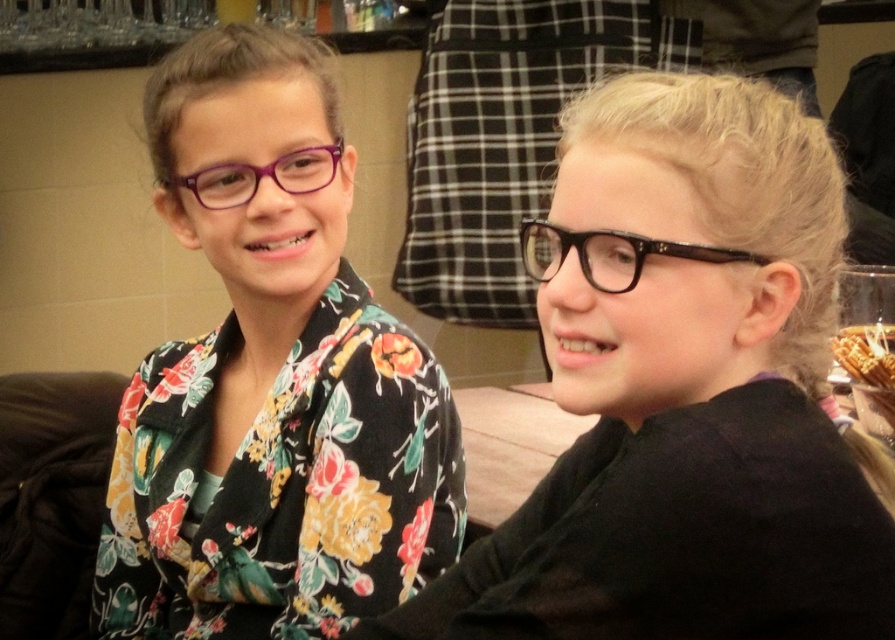
Question: Among these objects, which one is nearest to the camera?

Choices:
 (A) purple acetate glasses at left
 (B) black textured glasses at right
 (C) black glossy glasses at upper right

Answer: (C)

Question: Estimate the real-world distances between objects in this image. Which object is closer to the purple acetate glasses at left?

Choices:
 (A) matte purple glasses at left
 (B) black textured glasses at right

Answer: (A)

Question: Is matte purple glasses at left bigger than black textured glasses at right?

Choices:
 (A) no
 (B) yes

Answer: (B)

Question: Can you confirm if matte purple glasses at left is wider than black textured glasses at right?

Choices:
 (A) yes
 (B) no

Answer: (A)

Question: Which point is farther from the camera taking this photo?

Choices:
 (A) (631, 259)
 (B) (580, 220)
 (C) (322, 152)
 (D) (220, 561)

Answer: (C)

Question: Does matte purple glasses at left have a larger size compared to black textured glasses at right?

Choices:
 (A) yes
 (B) no

Answer: (A)